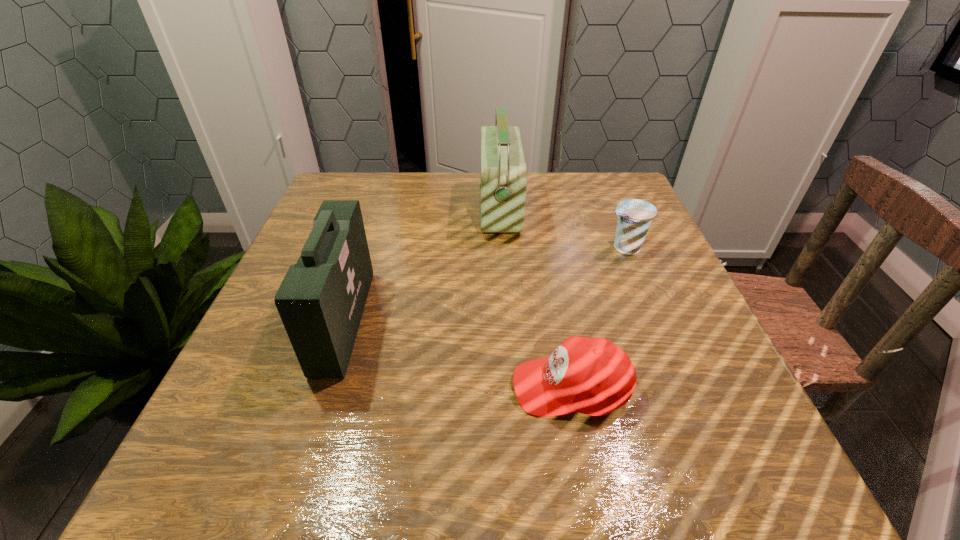
Where is `free spot between the rightmost object and the baseball cap`? free spot between the rightmost object and the baseball cap is located at coordinates (597, 318).

You are a GUI agent. You are given a task and a screenshot of the screen. Output one action in this format:
    pyautogui.click(x=<x>, y=<y>)
    Task: Click on the vacant space in between the yogurt and the leftmost object
    
    Given the screenshot: What is the action you would take?
    pyautogui.click(x=484, y=284)

You are a GUI agent. You are given a task and a screenshot of the screen. Output one action in this format:
    pyautogui.click(x=<x>, y=<y>)
    Task: Click on the vacant space that's between the leftmost object and the rightmost object
    This screenshot has height=540, width=960.
    Given the screenshot: What is the action you would take?
    pyautogui.click(x=484, y=284)

Locate an element on the screen. The height and width of the screenshot is (540, 960). vacant region between the radio receiver and the yogurt is located at coordinates (562, 228).

Locate an element on the screen. Image resolution: width=960 pixels, height=540 pixels. free space that is in between the rightmost object and the baseball cap is located at coordinates (597, 318).

Where is `free area in between the radio receiver and the rightmost object`? free area in between the radio receiver and the rightmost object is located at coordinates (562, 228).

The height and width of the screenshot is (540, 960). I want to click on free space between the radio receiver and the rightmost object, so tap(562, 228).

Where is `vacant area that lies between the baseball cap and the radio receiver`? Image resolution: width=960 pixels, height=540 pixels. vacant area that lies between the baseball cap and the radio receiver is located at coordinates (535, 298).

Locate an element on the screen. free area in between the yogurt and the radio receiver is located at coordinates (562, 228).

I want to click on vacant space in between the yogurt and the first-aid kit, so click(484, 284).